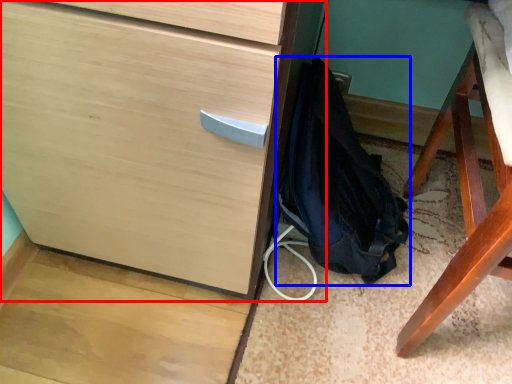
Question: Which point is closer to the camera, chest of drawers (highlighted by a red box) or backpack (highlighted by a blue box)?

Choices:
 (A) chest of drawers
 (B) backpack

Answer: (A)